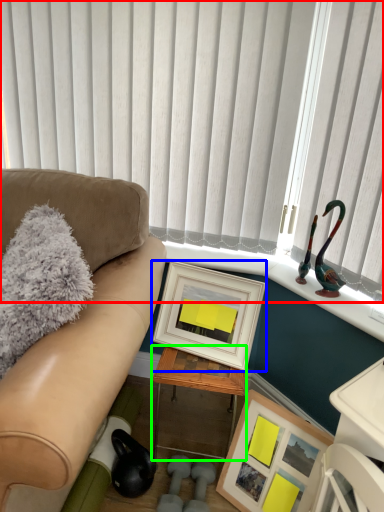
Question: Which object is the farthest from window blind (highlighted by a red box)? Choose among these: picture frame (highlighted by a blue box) or table (highlighted by a green box).

Choices:
 (A) picture frame
 (B) table

Answer: (B)